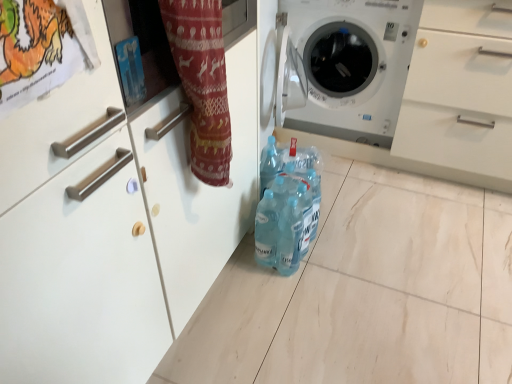
Question: From the image's perspective, would you say matte red fabric at center is shown under white plastic washing machine at center?

Choices:
 (A) yes
 (B) no

Answer: (A)

Question: Considering the relative sizes of matte red fabric at center and white plastic washing machine at center in the image provided, is matte red fabric at center smaller than white plastic washing machine at center?

Choices:
 (A) no
 (B) yes

Answer: (B)

Question: Can you confirm if matte red fabric at center is shorter than white plastic washing machine at center?

Choices:
 (A) yes
 (B) no

Answer: (A)

Question: Is white plastic washing machine at center located within matte red fabric at center?

Choices:
 (A) yes
 (B) no

Answer: (B)

Question: From a real-world perspective, is matte red fabric at center beneath white plastic washing machine at center?

Choices:
 (A) yes
 (B) no

Answer: (B)

Question: From the image's perspective, is translucent plastic bottles at center above or below white plastic washing machine at center?

Choices:
 (A) below
 (B) above

Answer: (A)

Question: Looking at their shapes, would you say translucent plastic bottles at center is wider or thinner than white plastic washing machine at center?

Choices:
 (A) wide
 (B) thin

Answer: (B)

Question: Would you say translucent plastic bottles at center is to the left or to the right of white plastic washing machine at center in the picture?

Choices:
 (A) right
 (B) left

Answer: (B)

Question: In terms of size, does translucent plastic bottles at center appear bigger or smaller than white plastic washing machine at center?

Choices:
 (A) big
 (B) small

Answer: (B)

Question: From the image's perspective, relative to translucent plastic bottles at center, is matte red fabric at center above or below?

Choices:
 (A) above
 (B) below

Answer: (A)

Question: Is matte red fabric at center wider or thinner than translucent plastic bottles at center?

Choices:
 (A) thin
 (B) wide

Answer: (A)

Question: From their relative heights in the image, would you say matte red fabric at center is taller or shorter than translucent plastic bottles at center?

Choices:
 (A) tall
 (B) short

Answer: (A)

Question: In the image, is matte red fabric at center on the left side or the right side of translucent plastic bottles at center?

Choices:
 (A) left
 (B) right

Answer: (A)

Question: Considering the positions of white plastic washing machine at center and matte red fabric at center in the image, is white plastic washing machine at center wider or thinner than matte red fabric at center?

Choices:
 (A) thin
 (B) wide

Answer: (B)

Question: Considering the positions of white plastic washing machine at center and matte red fabric at center in the image, is white plastic washing machine at center bigger or smaller than matte red fabric at center?

Choices:
 (A) big
 (B) small

Answer: (A)